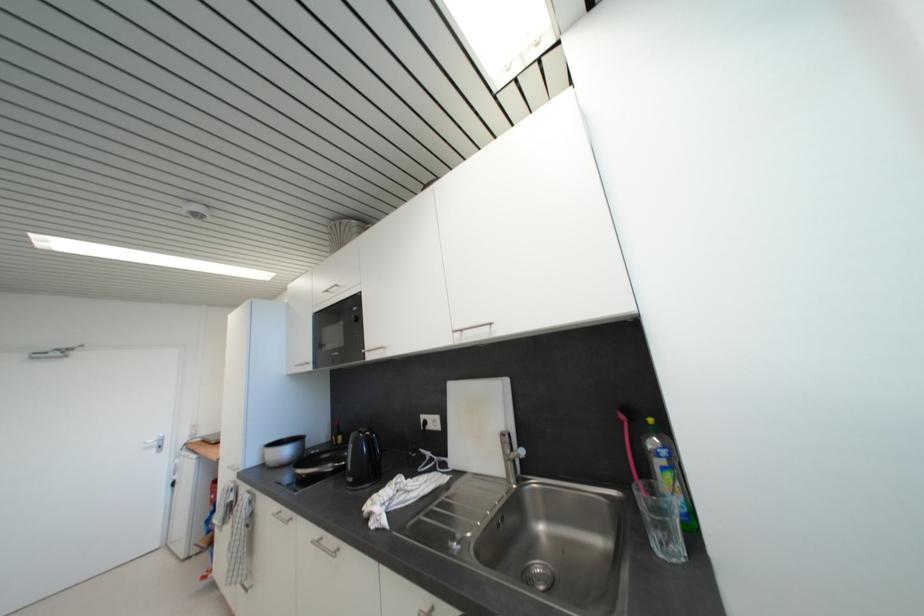
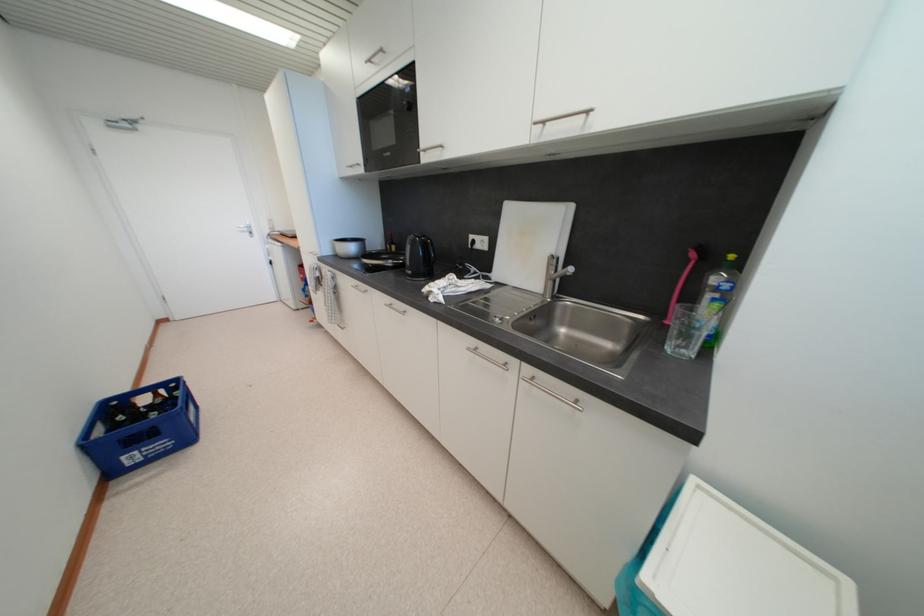
The point at (x=357, y=483) is marked in the first image. Where is the corresponding point in the second image?

(415, 275)